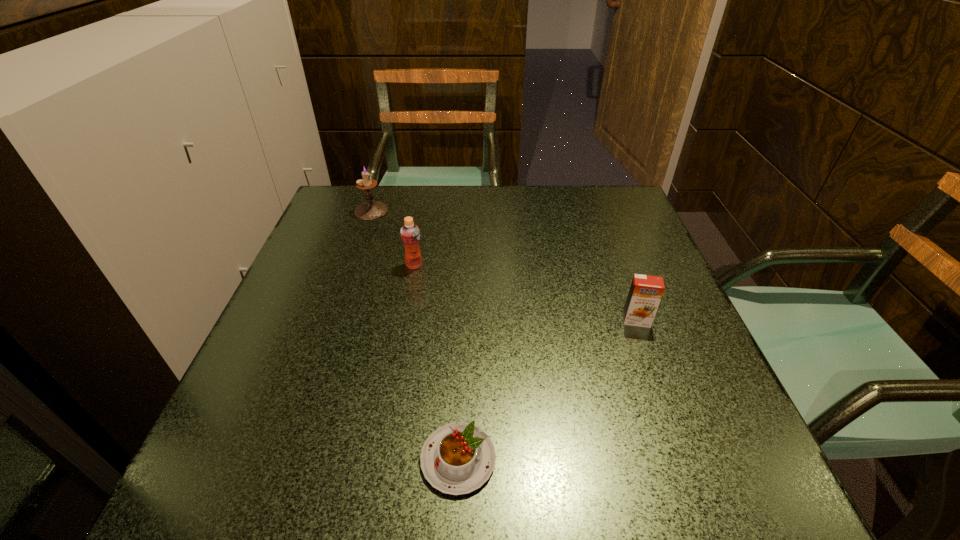
This screenshot has width=960, height=540. What are the coordinates of `vacant region at the right edge of the desktop` in the screenshot? It's located at (585, 242).

At what (x,y) coordinates should I click in order to perform the action: click on vacant area at the far left corner of the desktop. Please return your answer as a coordinate pair (x, y). This screenshot has height=540, width=960. Looking at the image, I should click on (341, 185).

In the image, there is a desktop. In order to click on vacant space at the far right corner in this screenshot , I will do `click(594, 213)`.

Identify the location of blank space at the near right corner. This screenshot has height=540, width=960. (736, 463).

In order to click on unoccupied position between the third object from right to left and the shorter orange juice in this screenshot , I will do `click(525, 293)`.

Identify the location of vacant area between the second object from right to left and the farther orange juice. The image size is (960, 540). (436, 362).

Find the location of a particular element. The image size is (960, 540). vacant space that's between the right orange juice and the farthest object is located at coordinates (504, 266).

The image size is (960, 540). Identify the location of vacant space in between the third object from right to left and the shorter orange juice. (525, 293).

Find the location of a particular element. Image resolution: width=960 pixels, height=540 pixels. unoccupied position between the left orange juice and the pudding is located at coordinates (436, 362).

Where is `free spot between the farthest object and the second farthest object`? The height and width of the screenshot is (540, 960). free spot between the farthest object and the second farthest object is located at coordinates (393, 238).